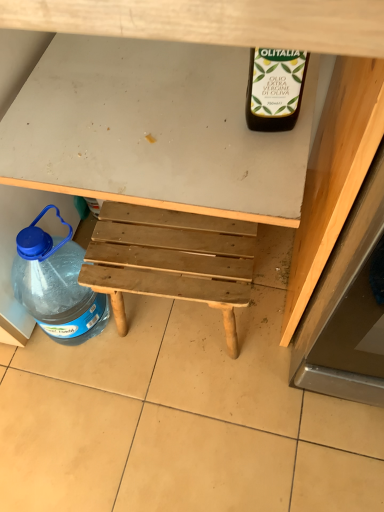
Question: Does natural wood stool at center have a larger size compared to wooden bench at center?

Choices:
 (A) yes
 (B) no

Answer: (B)

Question: From the image's perspective, is natural wood stool at center under wooden bench at center?

Choices:
 (A) no
 (B) yes

Answer: (B)

Question: From the image's perspective, does natural wood stool at center appear higher than wooden bench at center?

Choices:
 (A) yes
 (B) no

Answer: (B)

Question: Does natural wood stool at center appear on the right side of wooden bench at center?

Choices:
 (A) yes
 (B) no

Answer: (A)

Question: Is the position of natural wood stool at center more distant than that of wooden bench at center?

Choices:
 (A) yes
 (B) no

Answer: (A)

Question: Considering the relative sizes of natural wood stool at center and wooden bench at center in the image provided, is natural wood stool at center thinner than wooden bench at center?

Choices:
 (A) yes
 (B) no

Answer: (A)

Question: Is wooden bench at center thinner than transparent plastic bottle at lower left?

Choices:
 (A) no
 (B) yes

Answer: (A)

Question: Is wooden bench at center far from transparent plastic bottle at lower left?

Choices:
 (A) yes
 (B) no

Answer: (B)

Question: Is wooden bench at center facing towards transparent plastic bottle at lower left?

Choices:
 (A) yes
 (B) no

Answer: (A)

Question: Is wooden bench at center positioned behind transparent plastic bottle at lower left?

Choices:
 (A) no
 (B) yes

Answer: (A)

Question: From a real-world perspective, is wooden bench at center below transparent plastic bottle at lower left?

Choices:
 (A) no
 (B) yes

Answer: (A)

Question: Is wooden bench at center smaller than transparent plastic bottle at lower left?

Choices:
 (A) no
 (B) yes

Answer: (A)

Question: Can you confirm if transparent plastic bottle at lower left is positioned to the right of wooden bench at center?

Choices:
 (A) yes
 (B) no

Answer: (B)